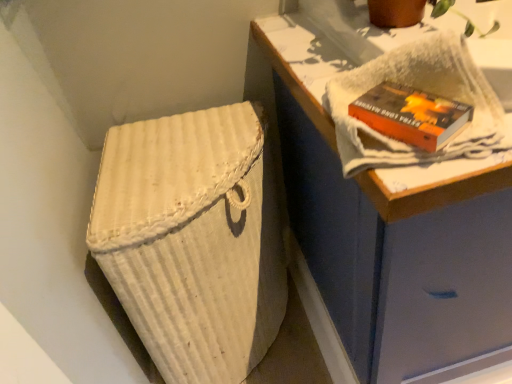
What do you see at coordinates (391, 235) in the screenshot? I see `white woven basket at lower left` at bounding box center [391, 235].

Find the location of `white woven laundry basket at lower left`. white woven laundry basket at lower left is located at coordinates click(192, 240).

Which of these two, white woven basket at lower left or white textured towel at upper right, is smaller?

white textured towel at upper right.

Does white woven basket at lower left lie in front of white textured towel at upper right?

No.

Based on the photo, is white textured towel at upper right a part of white woven basket at lower left?

No, white textured towel at upper right is not surrounded by white woven basket at lower left.

Which point is more forward, [498,302] or [402,82]?

The point [402,82] is more forward.

Does orange matte paperback book at upper right have a greater width compared to white woven laundry basket at lower left?

Incorrect, the width of orange matte paperback book at upper right does not surpass that of white woven laundry basket at lower left.

Is orange matte paperback book at upper right not within white woven laundry basket at lower left?

Yes.

Is orange matte paperback book at upper right taller than white woven laundry basket at lower left?

Incorrect, the height of orange matte paperback book at upper right is not larger of that of white woven laundry basket at lower left.

Between orange matte paperback book at upper right and white woven laundry basket at lower left, which one is positioned in front?

orange matte paperback book at upper right.

Does point (246, 292) come closer to viewer compared to point (316, 208)?

That is False.

Looking at the image, does white woven laundry basket at lower left seem bigger or smaller compared to white woven basket at lower left?

In the image, white woven laundry basket at lower left appears to be smaller than white woven basket at lower left.

This screenshot has width=512, height=384. I want to click on laundry basket that appears below the white woven basket at lower left (from a real-world perspective), so click(192, 240).

From the image's perspective, which one is positioned lower, white woven basket at lower left or orange matte paperback book at upper right?

white woven basket at lower left.

Would you say white woven basket at lower left is inside or outside orange matte paperback book at upper right?

white woven basket at lower left is outside orange matte paperback book at upper right.

Is white woven basket at lower left positioned before orange matte paperback book at upper right?

Yes, it is.

Visually, is white woven basket at lower left positioned to the left or to the right of orange matte paperback book at upper right?

Clearly, white woven basket at lower left is on the right of orange matte paperback book at upper right in the image.

Looking at the image, does white textured towel at upper right seem bigger or smaller compared to white woven laundry basket at lower left?

In the image, white textured towel at upper right appears to be smaller than white woven laundry basket at lower left.

Is white textured towel at upper right looking in the opposite direction of white woven laundry basket at lower left?

That's not correct — white textured towel at upper right is not looking away from white woven laundry basket at lower left.

At what (x,y) coordinates should I click in order to perform the action: click on laundry basket behind the white textured towel at upper right. Please return your answer as a coordinate pair (x, y). The height and width of the screenshot is (384, 512). Looking at the image, I should click on (192, 240).

Which is correct: white textured towel at upper right is inside white woven laundry basket at lower left, or outside of it?

white textured towel at upper right is not inside white woven laundry basket at lower left, it's outside.

Between white woven laundry basket at lower left and orange matte paperback book at upper right, which one is positioned behind?

white woven laundry basket at lower left is further away from the camera.

Is white woven laundry basket at lower left shorter than orange matte paperback book at upper right?

No, white woven laundry basket at lower left is not shorter than orange matte paperback book at upper right.

Which is less distant, (101,211) or (379,92)?

The point (379,92) is in front.

Consider the image. From a real-world perspective, is white woven laundry basket at lower left located higher than orange matte paperback book at upper right?

No, from a real-world perspective, white woven laundry basket at lower left is not over orange matte paperback book at upper right

I want to click on bath towel located above the white woven basket at lower left (from the image's perspective), so click(x=424, y=90).

From a real-world perspective, is white textured towel at upper right physically located above or below white woven basket at lower left?

In terms of real-world spatial position, white textured towel at upper right is above white woven basket at lower left.

Does white textured towel at upper right turn towards white woven basket at lower left?

No, white textured towel at upper right does not turn towards white woven basket at lower left.

Which is correct: white textured towel at upper right is inside white woven basket at lower left, or outside of it?

white textured towel at upper right is not inside white woven basket at lower left, it's outside.

In the image, there is a white textured towel at upper right. Where is `furniture below it (from a real-world perspective)`? The image size is (512, 384). furniture below it (from a real-world perspective) is located at coordinates (391, 235).

Locate an element on the screen. This screenshot has height=384, width=512. laundry basket that is on the left side of orange matte paperback book at upper right is located at coordinates (192, 240).

Looking at the image, which one is located closer to orange matte paperback book at upper right, white woven basket at lower left or white woven laundry basket at lower left?

white woven basket at lower left.

Which object lies nearer to the anchor point white woven basket at lower left, white textured towel at upper right or orange matte paperback book at upper right?

The object closer to white woven basket at lower left is white textured towel at upper right.

Which object lies further to the anchor point white woven laundry basket at lower left, white textured towel at upper right or orange matte paperback book at upper right?

orange matte paperback book at upper right is further to white woven laundry basket at lower left.

Consider the image. From the image, which object appears to be nearer to white textured towel at upper right, white woven laundry basket at lower left or orange matte paperback book at upper right?

Based on the image, orange matte paperback book at upper right appears to be nearer to white textured towel at upper right.

From the image, which object appears to be farther from orange matte paperback book at upper right, white woven laundry basket at lower left or white woven basket at lower left?

The object further to orange matte paperback book at upper right is white woven laundry basket at lower left.

When comparing their distances from white textured towel at upper right, does white woven basket at lower left or white woven laundry basket at lower left seem closer?

white woven basket at lower left.

From the image, which object appears to be nearer to white woven laundry basket at lower left, orange matte paperback book at upper right or white woven basket at lower left?

The object closer to white woven laundry basket at lower left is white woven basket at lower left.

From the image, which object appears to be farther from orange matte paperback book at upper right, white woven laundry basket at lower left or white textured towel at upper right?

white woven laundry basket at lower left lies further to orange matte paperback book at upper right than the other object.

You are a GUI agent. You are given a task and a screenshot of the screen. Output one action in this format:
    pyautogui.click(x=<x>, y=<y>)
    Task: Click on the paperback book between white textured towel at upper right and white woven laundry basket at lower left vertically
    The image size is (512, 384).
    Given the screenshot: What is the action you would take?
    pyautogui.click(x=411, y=115)

Where is `bath towel between orange matte paperback book at upper right and white woven basket at lower left in the horizontal direction`? The image size is (512, 384). bath towel between orange matte paperback book at upper right and white woven basket at lower left in the horizontal direction is located at coordinates (424, 90).

Where is `bath towel situated between white woven laundry basket at lower left and white woven basket at lower left from left to right`? This screenshot has width=512, height=384. bath towel situated between white woven laundry basket at lower left and white woven basket at lower left from left to right is located at coordinates (424, 90).

At what (x,y) coordinates should I click in order to perform the action: click on paperback book between white woven laundry basket at lower left and white woven basket at lower left from left to right. Please return your answer as a coordinate pair (x, y). Looking at the image, I should click on (411, 115).